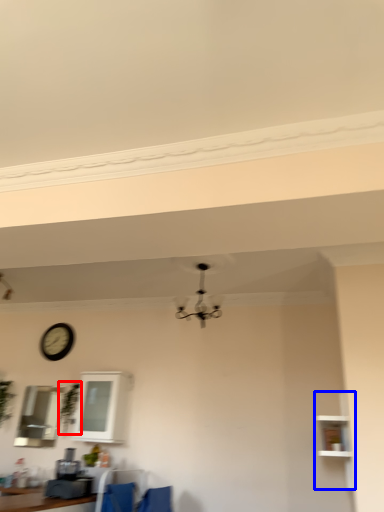
Question: Which object is further to the camera taking this photo, plant (highlighted by a red box) or shelf (highlighted by a blue box)?

Choices:
 (A) plant
 (B) shelf

Answer: (A)